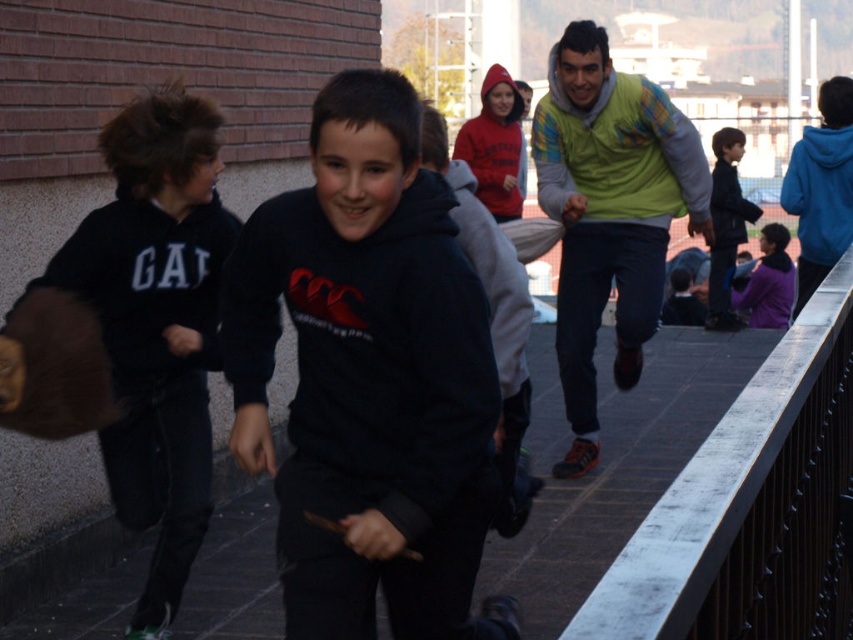
Which is above, black fleece jacket at left or red fleece hoodie at center?

Positioned higher is red fleece hoodie at center.

Can you confirm if black fleece jacket at left is positioned above red fleece hoodie at center?

Incorrect, black fleece jacket at left is not positioned above red fleece hoodie at center.

Between point (102, 400) and point (496, 100), which one is positioned in front?

Positioned in front is point (102, 400).

This screenshot has width=853, height=640. I want to click on black fleece jacket at left, so click(135, 333).

Is black hoodie at center to the right of black fleece jacket at left from the viewer's perspective?

Correct, you'll find black hoodie at center to the right of black fleece jacket at left.

Can you confirm if black hoodie at center is taller than black fleece jacket at left?

In fact, black hoodie at center may be shorter than black fleece jacket at left.

Is point (289, 275) positioned in front of point (154, 632)?

Yes, point (289, 275) is in front of point (154, 632).

Where is `black hoodie at center`? The image size is (853, 640). black hoodie at center is located at coordinates (369, 378).

Is the position of green sweater at center more distant than that of red fleece hoodie at center?

No.

This screenshot has height=640, width=853. In order to click on green sweater at center in this screenshot , I will do `click(608, 212)`.

Locate an element on the screen. The width and height of the screenshot is (853, 640). green sweater at center is located at coordinates (608, 212).